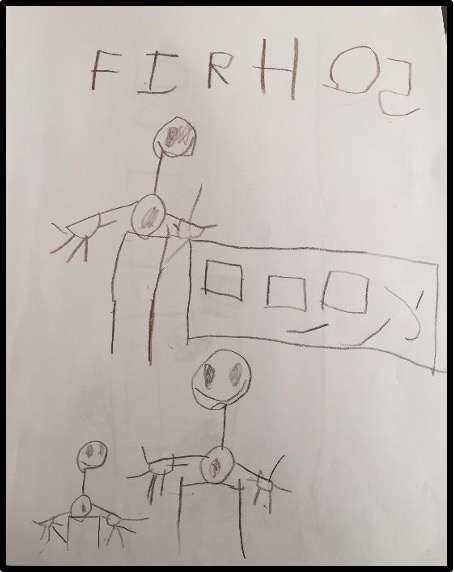
Find the location of `piece of white paper`. piece of white paper is located at coordinates (270, 188).